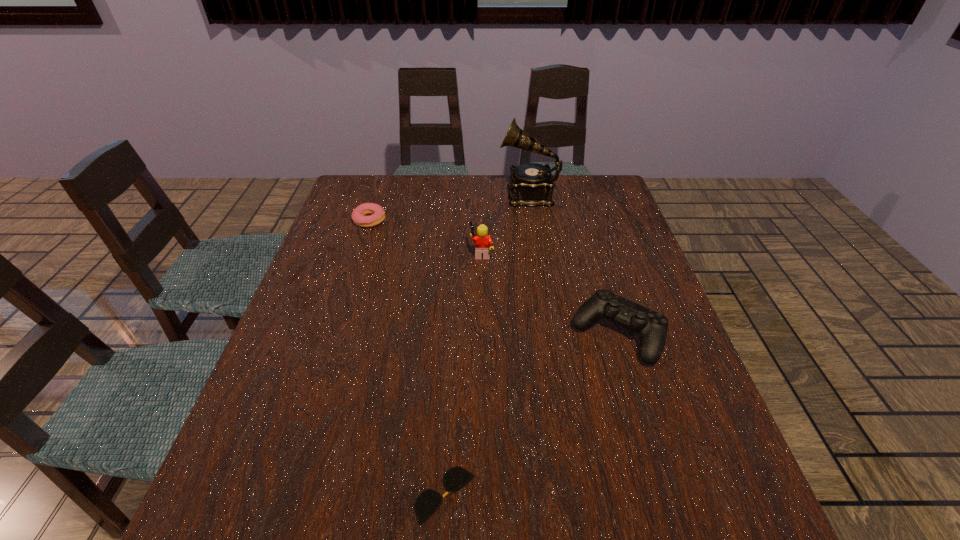
Identify the location of vacant position located on the horn of the farthest object. The width and height of the screenshot is (960, 540). (414, 194).

The height and width of the screenshot is (540, 960). Identify the location of free location located on the horn of the farthest object. (407, 194).

The width and height of the screenshot is (960, 540). In order to click on free space located 0.390m on the horn of the farthest object in this screenshot , I will do `click(384, 194)`.

What are the coordinates of `free space located in front of the third nearest object with the accessory visible` in the screenshot? It's located at (407, 253).

Where is `vacant space located 0.140m in front of the third nearest object with the accessory visible`? This screenshot has height=540, width=960. vacant space located 0.140m in front of the third nearest object with the accessory visible is located at coordinates (420, 253).

Locate an element on the screen. This screenshot has height=540, width=960. vacant space located 0.310m in front of the third nearest object with the accessory visible is located at coordinates (362, 253).

The width and height of the screenshot is (960, 540). Identify the location of vacant space located on the left of the fourth farthest object. (415, 334).

Locate an element on the screen. vacant position located 0.100m on the back of the fourth tallest object is located at coordinates (378, 195).

In order to click on vacant space located 0.200m on the left of the spectacles in this screenshot , I will do `click(300, 495)`.

Locate an element on the screen. phonograph record that is at the far edge is located at coordinates (531, 184).